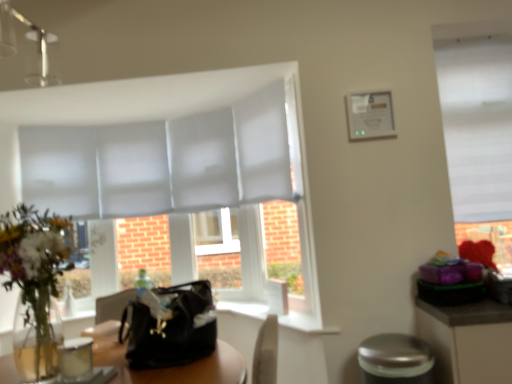
Question: From the image's perspective, is white smooth window sill at center on white matte window at upper right?

Choices:
 (A) no
 (B) yes

Answer: (A)

Question: Can you confirm if white smooth window sill at center is taller than white matte window at upper right?

Choices:
 (A) yes
 (B) no

Answer: (B)

Question: Can you confirm if white smooth window sill at center is shorter than white matte window at upper right?

Choices:
 (A) no
 (B) yes

Answer: (B)

Question: Is white smooth window sill at center at the left side of white matte window at upper right?

Choices:
 (A) yes
 (B) no

Answer: (A)

Question: Can you see white smooth window sill at center touching white matte window at upper right?

Choices:
 (A) yes
 (B) no

Answer: (B)

Question: Is white smooth window sill at center bigger than white matte window at upper right?

Choices:
 (A) yes
 (B) no

Answer: (B)

Question: Could you tell me if black leather handbag at center is turned towards silver metallic bar stool at lower right?

Choices:
 (A) yes
 (B) no

Answer: (B)

Question: Is black leather handbag at center bigger than silver metallic bar stool at lower right?

Choices:
 (A) yes
 (B) no

Answer: (A)

Question: Is black leather handbag at center looking in the opposite direction of silver metallic bar stool at lower right?

Choices:
 (A) yes
 (B) no

Answer: (B)

Question: Is black leather handbag at center shorter than silver metallic bar stool at lower right?

Choices:
 (A) yes
 (B) no

Answer: (A)

Question: Is black leather handbag at center to the left of silver metallic bar stool at lower right from the viewer's perspective?

Choices:
 (A) no
 (B) yes

Answer: (B)

Question: From a real-world perspective, is black leather handbag at center physically below silver metallic bar stool at lower right?

Choices:
 (A) yes
 (B) no

Answer: (B)

Question: Can you confirm if white smooth window sill at center is taller than black leather handbag at center?

Choices:
 (A) yes
 (B) no

Answer: (B)